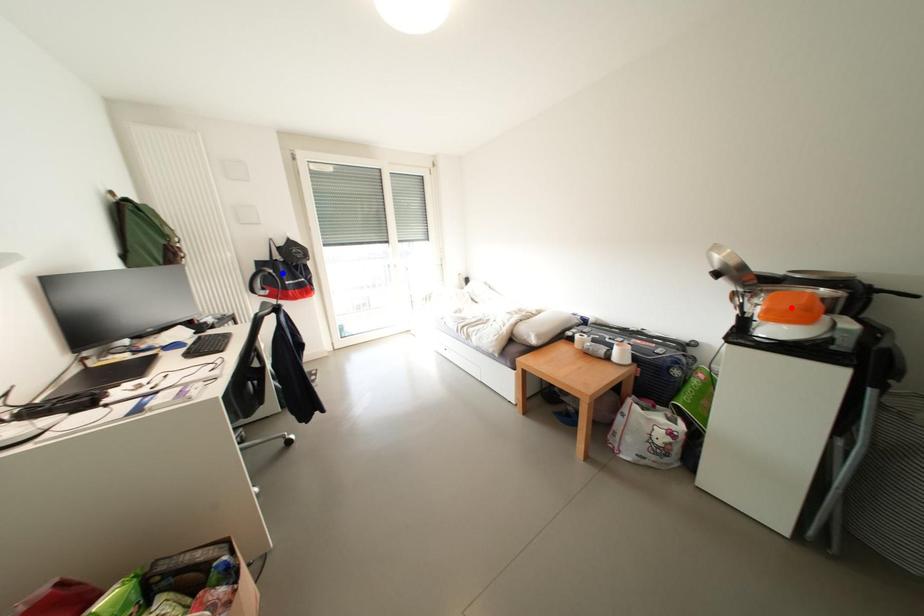
Question: Two points are marked on the image. Which point is closer to the camera?

Choices:
 (A) Blue point is closer.
 (B) Red point is closer.

Answer: (B)